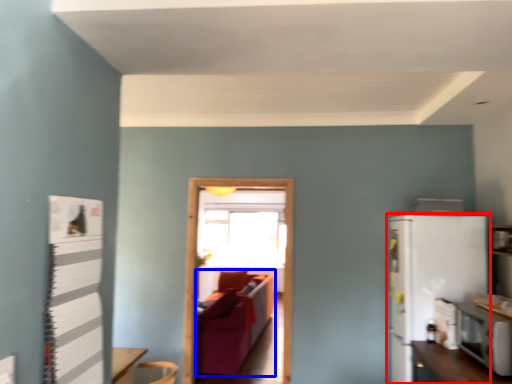
Question: Which object is further to the camera taking this photo, refrigerator (highlighted by a red box) or couch (highlighted by a blue box)?

Choices:
 (A) refrigerator
 (B) couch

Answer: (B)